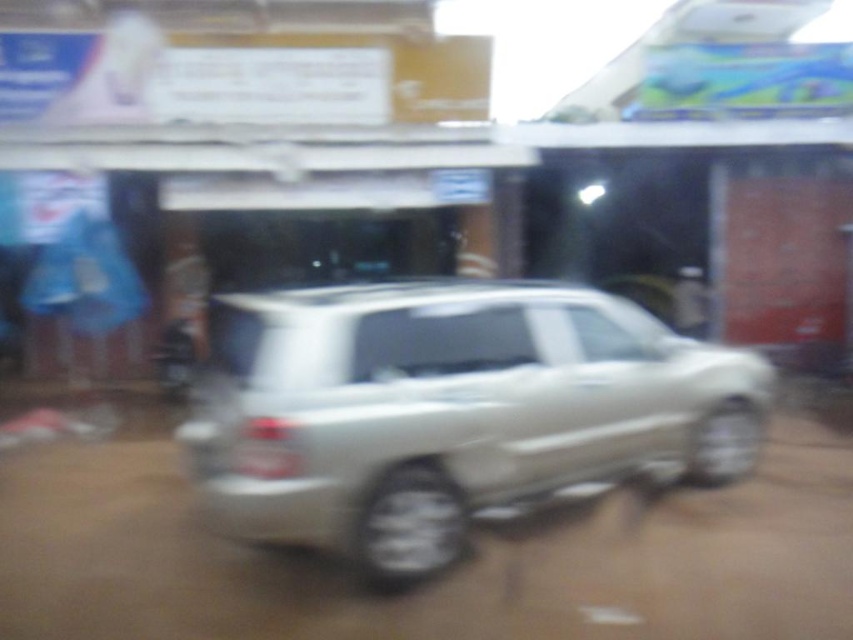
Between satin silver suv at center and white plastic license plate at center, which one appears on the right side from the viewer's perspective?

Positioned to the right is satin silver suv at center.

Locate an element on the screen. Image resolution: width=853 pixels, height=640 pixels. satin silver suv at center is located at coordinates (453, 410).